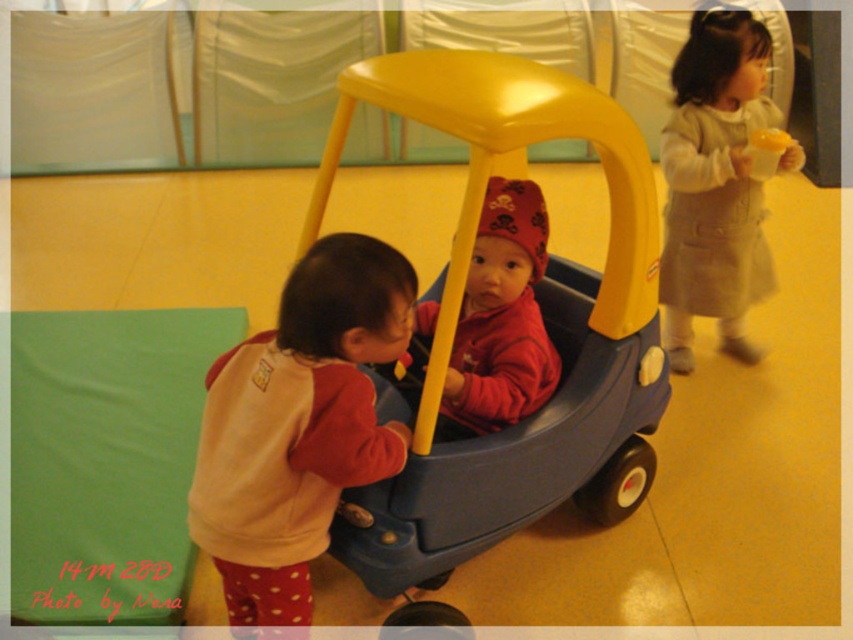
Question: Which of the following is the farthest from the observer?

Choices:
 (A) blue plastic car at center
 (B) matte red hoodie at center

Answer: (B)

Question: Which is nearer to the matte red hoodie at center?

Choices:
 (A) beige woolen dress at upper right
 (B) beige fleece sweater at left
 (C) blue plastic car at center

Answer: (C)

Question: Which object is farther from the camera taking this photo?

Choices:
 (A) matte red hoodie at center
 (B) beige fleece sweater at left
 (C) blue plastic car at center

Answer: (A)

Question: Is blue plastic car at center smaller than beige woolen dress at upper right?

Choices:
 (A) yes
 (B) no

Answer: (B)

Question: Is beige fleece sweater at left to the right of matte red hoodie at center from the viewer's perspective?

Choices:
 (A) yes
 (B) no

Answer: (B)

Question: Can you confirm if blue plastic car at center is wider than beige woolen dress at upper right?

Choices:
 (A) yes
 (B) no

Answer: (A)